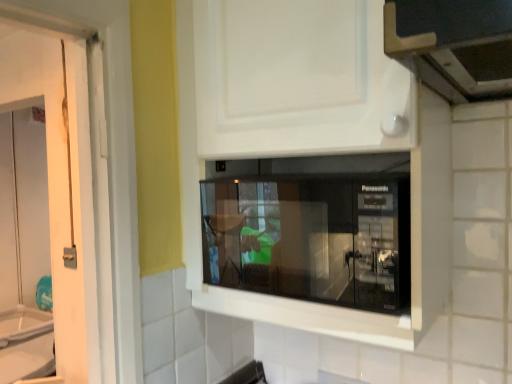
What do you see at coordinates (311, 229) in the screenshot? I see `black glossy microwave at center` at bounding box center [311, 229].

Image resolution: width=512 pixels, height=384 pixels. Identify the location of black glossy microwave at center. (311, 229).

Measure the distance between black glossy microwave at center and camera.

5.85 feet.

Measure the distance between point (398, 182) and camera.

They are 29.37 inches apart.

What do you see at coordinates (311, 138) in the screenshot?
I see `matte black microwave at center` at bounding box center [311, 138].

This screenshot has height=384, width=512. What are the coordinates of `matte black microwave at center` in the screenshot? It's located at (311, 138).

At what (x,y) coordinates should I click in order to perform the action: click on black glossy microwave at center. Please return your answer as a coordinate pair (x, y). The width and height of the screenshot is (512, 384). Looking at the image, I should click on (311, 229).

Is matte black microwave at center to the right of black glossy microwave at center from the viewer's perspective?

Yes.

Based on the photo, which object is closer to the camera, matte black microwave at center or black glossy microwave at center?

matte black microwave at center is in front.

Which is in front, point (351, 68) or point (312, 249)?

The point (351, 68) is in front.

From the image's perspective, is matte black microwave at center on black glossy microwave at center?

Yes.

From a real-world perspective, is matte black microwave at center positioned over black glossy microwave at center based on gravity?

Yes, from a real-world perspective, matte black microwave at center is above black glossy microwave at center.

Is matte black microwave at center thinner than black glossy microwave at center?

Incorrect, the width of matte black microwave at center is not less than that of black glossy microwave at center.

Who is shorter, matte black microwave at center or black glossy microwave at center?

Standing shorter between the two is black glossy microwave at center.

In terms of size, does matte black microwave at center appear bigger or smaller than black glossy microwave at center?

Clearly, matte black microwave at center is larger in size than black glossy microwave at center.

Is black glossy microwave at center a part of matte black microwave at center?

Yes, matte black microwave at center is surrounding black glossy microwave at center.

Is matte black microwave at center not close to black glossy microwave at center?

matte black microwave at center is actually quite close to black glossy microwave at center.

Could you tell me if matte black microwave at center is facing black glossy microwave at center?

Yes, matte black microwave at center is facing black glossy microwave at center.

What's the angular difference between matte black microwave at center and black glossy microwave at center's facing directions?

matte black microwave at center and black glossy microwave at center are facing 3.91 degrees away from each other.

Identify the location of microwave oven below the matte black microwave at center (from a real-world perspective). (311, 229).

Is black glossy microwave at center at the left side of matte black microwave at center?

Indeed, black glossy microwave at center is positioned on the left side of matte black microwave at center.

From the picture: Which object is further away from the camera taking this photo, black glossy microwave at center or matte black microwave at center?

black glossy microwave at center is more distant.

Is point (339, 258) closer to camera compared to point (203, 93)?

That is True.

From the image's perspective, between black glossy microwave at center and matte black microwave at center, who is located below?

black glossy microwave at center appears lower in the image.

Based on the photo, from a real-world perspective, is black glossy microwave at center positioned over matte black microwave at center based on gravity?

Actually, black glossy microwave at center is physically below matte black microwave at center in the real world.

In the scene shown: Considering the relative sizes of black glossy microwave at center and matte black microwave at center in the image provided, is black glossy microwave at center thinner than matte black microwave at center?

Yes, black glossy microwave at center is thinner than matte black microwave at center.

Is black glossy microwave at center taller than matte black microwave at center?

In fact, black glossy microwave at center may be shorter than matte black microwave at center.

Between black glossy microwave at center and matte black microwave at center, which one has smaller size?

black glossy microwave at center is smaller.

Is black glossy microwave at center positioned beyond the bounds of matte black microwave at center?

That's incorrect, black glossy microwave at center is not completely outside matte black microwave at center.

Is black glossy microwave at center next to matte black microwave at center?

black glossy microwave at center is not next to matte black microwave at center, and they're not touching.

Does black glossy microwave at center turn towards matte black microwave at center?

Yes, black glossy microwave at center is aimed at matte black microwave at center.

You are a GUI agent. You are given a task and a screenshot of the screen. Output one action in this format:
    pyautogui.click(x=<x>, y=<y>)
    Task: Click on the microwave oven lying behind the matte black microwave at center
    The width and height of the screenshot is (512, 384).
    Given the screenshot: What is the action you would take?
    pyautogui.click(x=311, y=229)

Image resolution: width=512 pixels, height=384 pixels. Find the location of `cabinetry above the black glossy microwave at center (from the image's perspective)`. cabinetry above the black glossy microwave at center (from the image's perspective) is located at coordinates 311,138.

Identify the location of cabinetry on the right side of black glossy microwave at center. (311, 138).